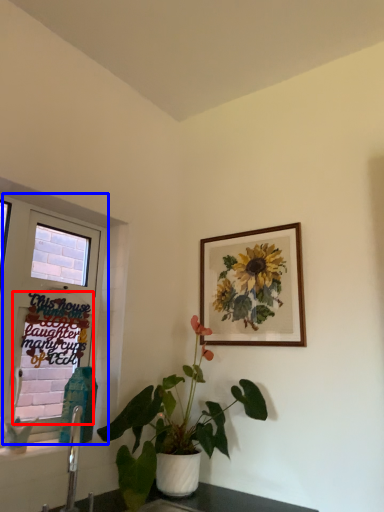
Question: Which object is further to the camera taking this photo, window screen (highlighted by a red box) or window (highlighted by a blue box)?

Choices:
 (A) window screen
 (B) window

Answer: (A)